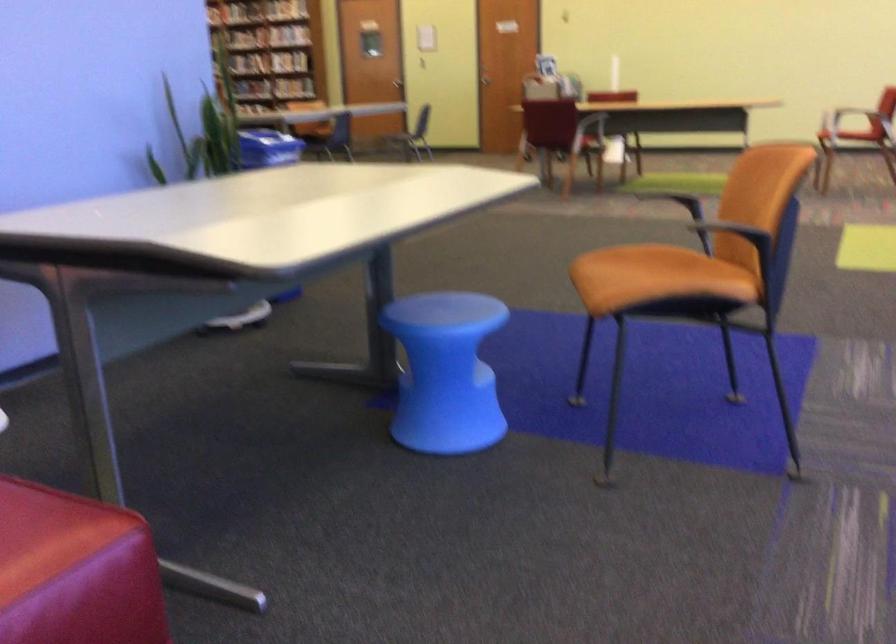
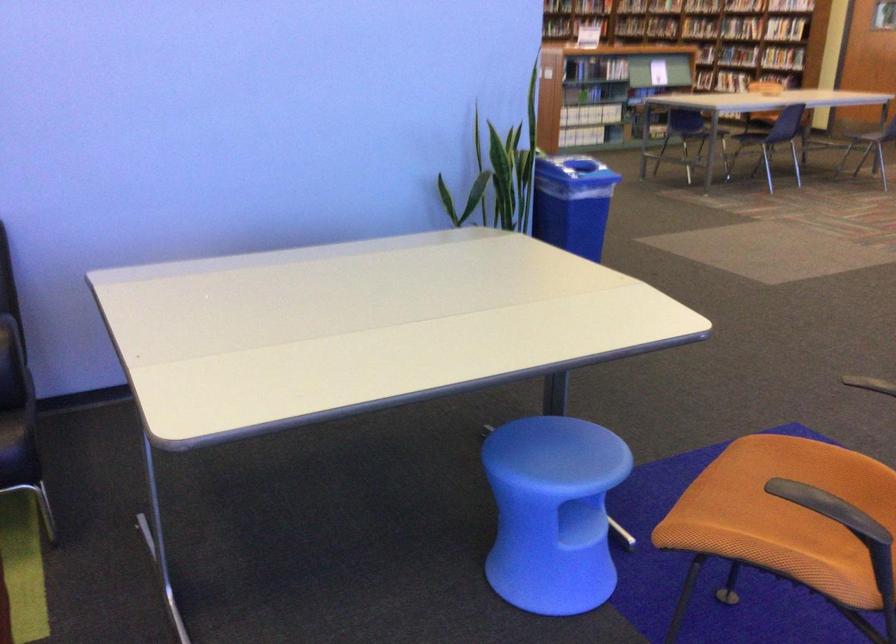
The point at (474, 352) is marked in the first image. Where is the corresponding point in the second image?

(553, 512)